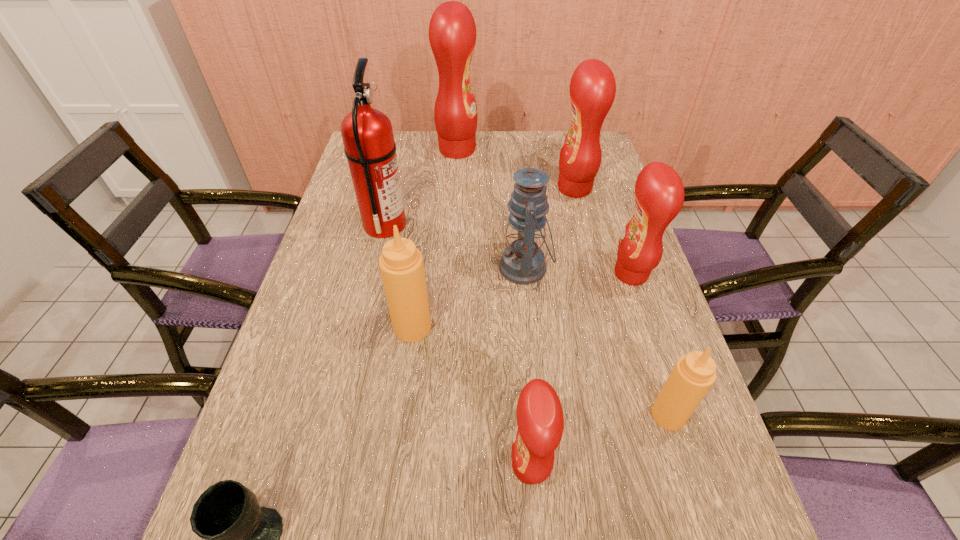
Where is `the tallest condiment`? The image size is (960, 540). the tallest condiment is located at coordinates (452, 31).

At what (x,y) coordinates should I click in order to perform the action: click on the farthest object. Please return your answer as a coordinate pair (x, y). This screenshot has width=960, height=540. Looking at the image, I should click on (452, 31).

Locate an element on the screen. red fire extinguisher is located at coordinates (367, 133).

At what (x,y) coordinates should I click in order to perform the action: click on the second tallest condiment. Please return your answer as a coordinate pair (x, y). The height and width of the screenshot is (540, 960). Looking at the image, I should click on (592, 87).

This screenshot has width=960, height=540. Find the location of `the seventh shortest object`. the seventh shortest object is located at coordinates click(x=592, y=87).

Where is `the left tan condiment`? The image size is (960, 540). the left tan condiment is located at coordinates (401, 264).

You are a GUI agent. You are given a task and a screenshot of the screen. Output one action in this format:
    pyautogui.click(x=<x>, y=<y>)
    Task: Click on the farther tan condiment
    
    Given the screenshot: What is the action you would take?
    pyautogui.click(x=401, y=264)

Image resolution: width=960 pixels, height=540 pixels. Find the location of `the second nearest red condiment`. the second nearest red condiment is located at coordinates (659, 192).

I want to click on the second smallest red condiment, so 659,192.

Where is `lantern`? This screenshot has width=960, height=540. lantern is located at coordinates (523, 262).